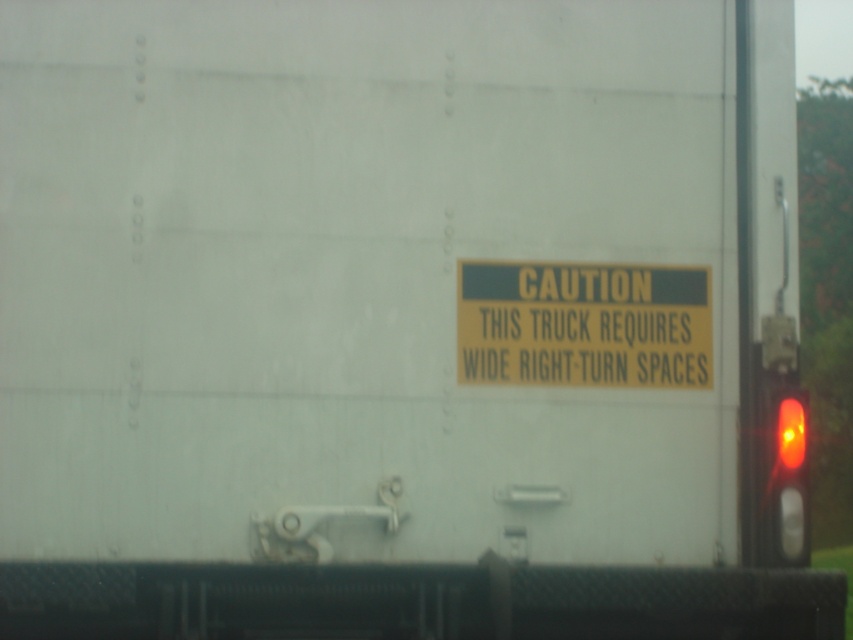
You are a delivery driver who needs to attach a new caution sticker next to the yellow paper sign at center and the amber glass traffic light at right on the truck. Which object should you place the sticker closer to to ensure it doesn

The yellow paper sign at center is larger than the amber glass traffic light at right, so placing the sticker closer to the yellow paper sign at center would ensure proper spacing.

You are a delivery driver approaching a narrow alleyway. Your truck has a wide right turn requirement. You see the yellow paper sign at center and the amber glass traffic light at right. Which object is positioned higher up in the scene?

The yellow paper sign at center is located above the amber glass traffic light at right, so the yellow paper sign at center is positioned higher up in the scene.